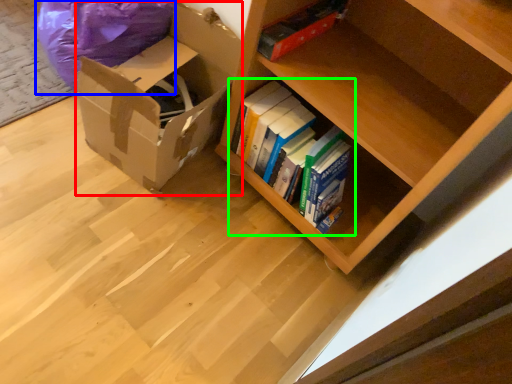
Question: Which is nearer to the cardboard box (highlighted by a red box)? bean bag chair (highlighted by a blue box) or book (highlighted by a green box).

Choices:
 (A) bean bag chair
 (B) book

Answer: (A)